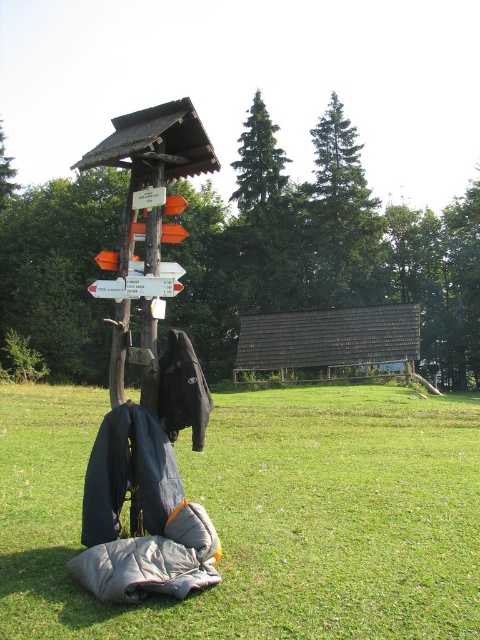
Who is more forward, (328,564) or (142,340)?

Point (328,564) is in front.

Is point (32, 573) positioned behind point (154, 161)?

That is False.

Where is `gray fabric sleeping bag at lower center`? gray fabric sleeping bag at lower center is located at coordinates (264, 515).

Is point (300, 188) closer to camera compared to point (399, 304)?

No, (300, 188) is further to viewer.

Does green leafy tree at upper center appear over brown shingled hut at center?

Correct, green leafy tree at upper center is located above brown shingled hut at center.

Find the location of `green leafy tree at upper center`. green leafy tree at upper center is located at coordinates (327, 256).

What are the coordinates of `green leafy tree at upper center` in the screenshot? It's located at pos(327,256).

Who is shorter, gray fabric sleeping bag at lower center or green leafy tree at upper center?

With less height is gray fabric sleeping bag at lower center.

Who is positioned more to the left, gray fabric sleeping bag at lower center or green leafy tree at upper center?

From the viewer's perspective, gray fabric sleeping bag at lower center appears more on the left side.

Describe the element at coordinates (264, 515) in the screenshot. The height and width of the screenshot is (640, 480). I see `gray fabric sleeping bag at lower center` at that location.

The width and height of the screenshot is (480, 640). I want to click on gray fabric sleeping bag at lower center, so click(264, 515).